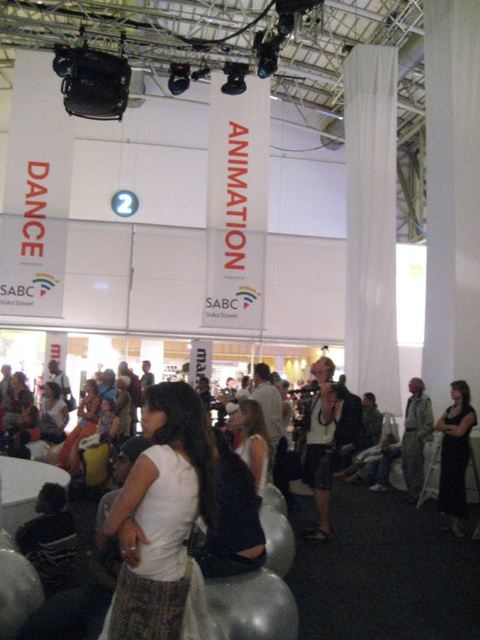
Question: Does white matte dress at center come behind matte white dress at center?

Choices:
 (A) no
 (B) yes

Answer: (A)

Question: Does black satin dress at right have a smaller size compared to white matte dress at center?

Choices:
 (A) no
 (B) yes

Answer: (A)

Question: Which point is farther to the camera?

Choices:
 (A) (256, 413)
 (B) (60, 410)
 (C) (141, 524)
 (D) (455, 490)

Answer: (B)

Question: Is white fabric dress at center smaller than white matte dress at center?

Choices:
 (A) no
 (B) yes

Answer: (B)

Question: Estimate the real-world distances between objects in this image. Which object is farther from the white matte dress at center?

Choices:
 (A) matte white dress at center
 (B) black satin dress at right
 (C) white fabric dress at center

Answer: (A)

Question: Which object appears farthest from the camera in this image?

Choices:
 (A) matte white dress at center
 (B) white matte dress at center

Answer: (A)